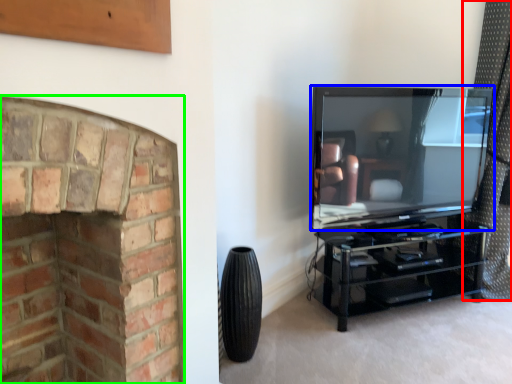
Question: Which object is the closest to the curtain (highlighted by a red box)? Choose among these: television (highlighted by a blue box) or fireplace (highlighted by a green box).

Choices:
 (A) television
 (B) fireplace

Answer: (A)